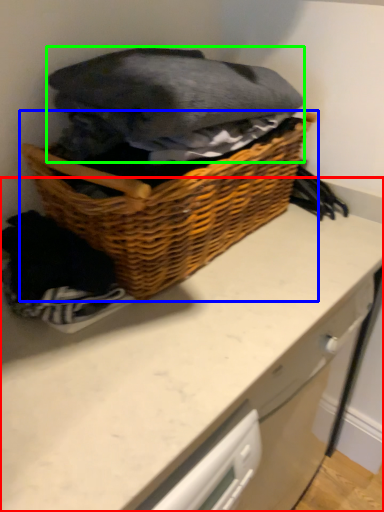
Question: Based on their relative distances, which object is farther from counter (highlighted by a red box)? Choose from picnic basket (highlighted by a blue box) and clothing (highlighted by a green box).

Choices:
 (A) picnic basket
 (B) clothing

Answer: (B)